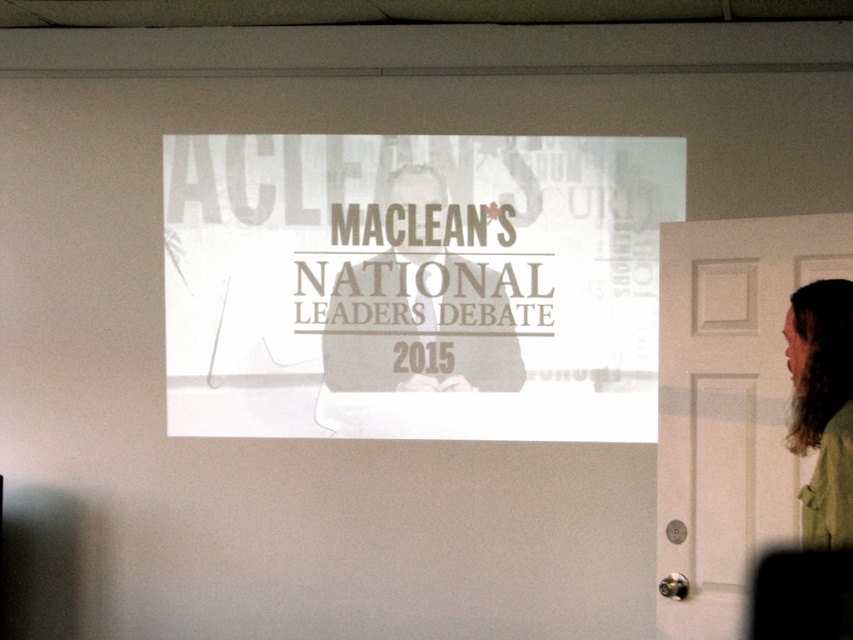
Between white paper at center and green matte jacket at right, which one has more height?

white paper at center

Between point (256, 308) and point (830, 472), which one is positioned in front?

Positioned in front is point (830, 472).

In order to click on white paper at center in this screenshot , I will do `click(415, 284)`.

You are a GUI agent. You are given a task and a screenshot of the screen. Output one action in this format:
    pyautogui.click(x=<x>, y=<y>)
    Task: Click on the white paper at center
    The image size is (853, 640).
    Given the screenshot: What is the action you would take?
    pyautogui.click(x=415, y=284)

Is white paper at center taller than matte paper sign at center?

Yes, white paper at center is taller than matte paper sign at center.

Is point (463, 364) positioned before point (389, 301)?

Yes, it is.

Find the location of a particular element. The height and width of the screenshot is (640, 853). white paper at center is located at coordinates (415, 284).

Can you confirm if matte paper sign at center is positioned to the left of green matte jacket at right?

Yes, matte paper sign at center is to the left of green matte jacket at right.

What do you see at coordinates (422, 300) in the screenshot? I see `matte paper sign at center` at bounding box center [422, 300].

What are the coordinates of `matte paper sign at center` in the screenshot? It's located at (422, 300).